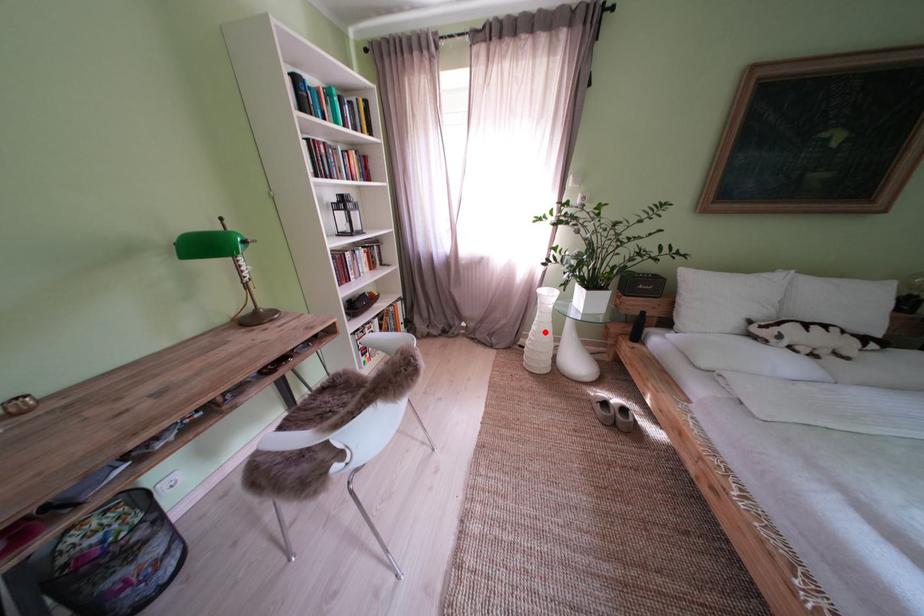
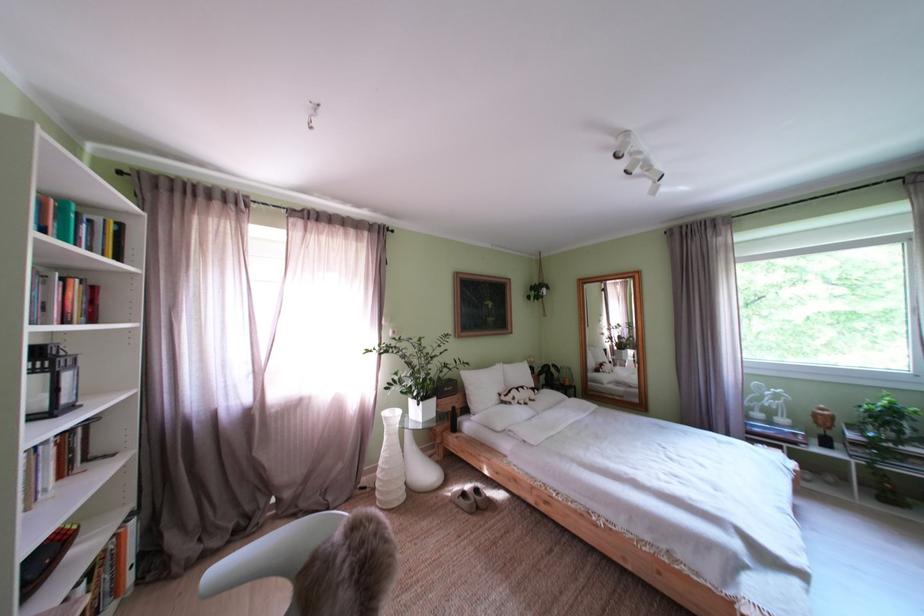
Where in the second image is the point corresponding to the highlighted location from the first image?

(395, 460)